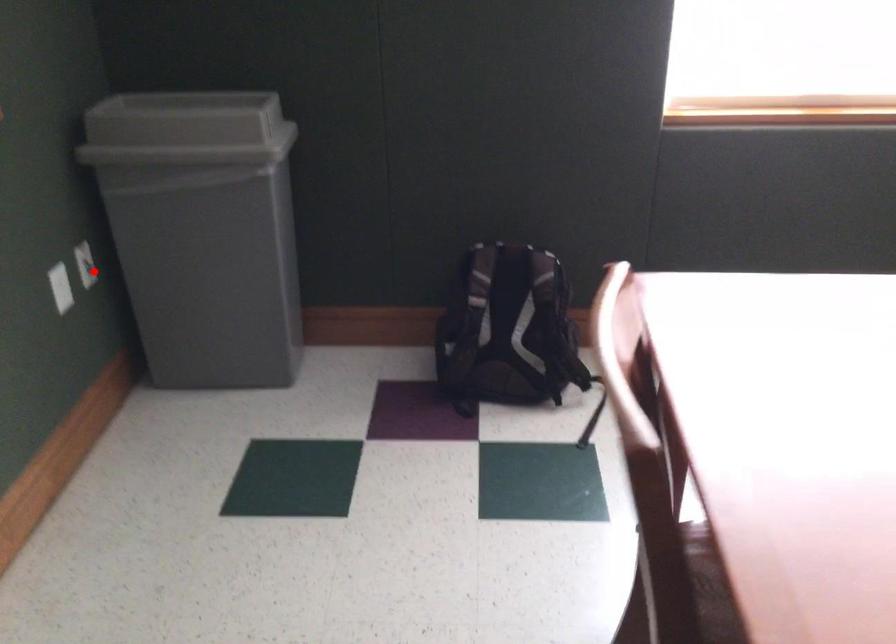
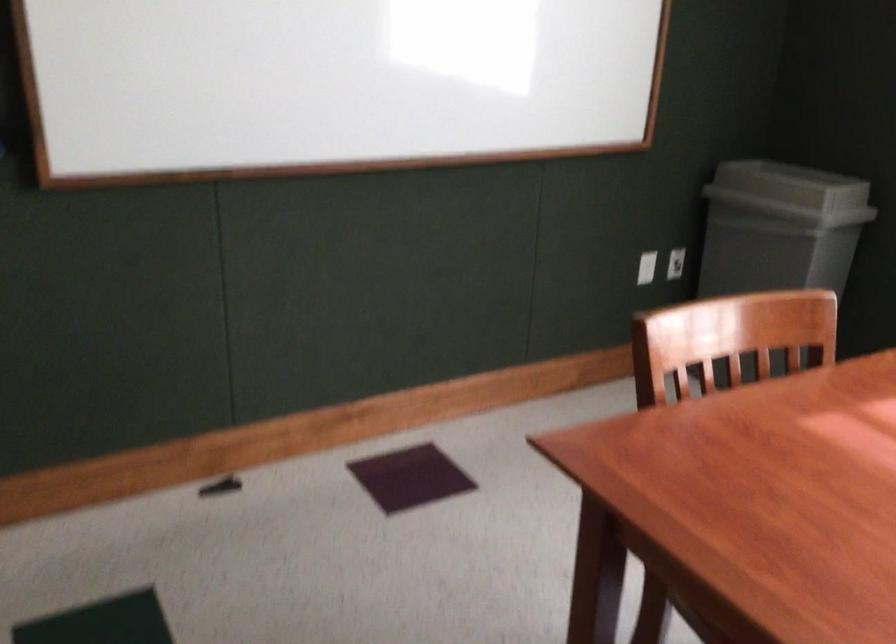
Question: I am providing you with two images of the same scene from different viewpoints. In image1, a red point is highlighted. Considering the same 3D point in image2, which of the following is correct?

Choices:
 (A) It is closer
 (B) It is farther

Answer: (B)